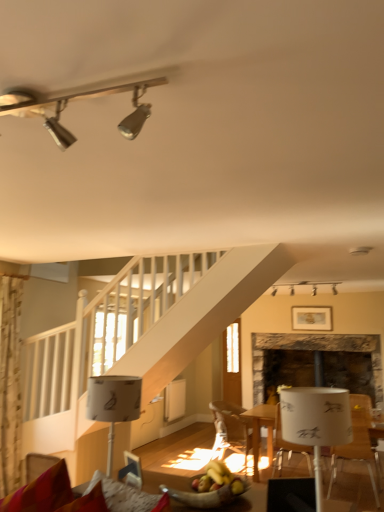
Find the location of a particular element. white plastic chair at lower right, arranged as the 1th chair when viewed from the right is located at coordinates (358, 443).

Measure the distance between point (29, 485) and camera.

Point (29, 485) and camera are 7.10 feet apart from each other.

Image resolution: width=384 pixels, height=512 pixels. In order to click on white plastic chair at lower right, which is counted as the 2th chair, starting from the back in this screenshot , I will do `click(358, 443)`.

Is wooden chair at center, acting as the 2th chair starting from the front, with white paper lampshade at upper center, the third lamp positioned from the front?

No, wooden chair at center, acting as the 2th chair starting from the front, is not making contact with white paper lampshade at upper center, the third lamp positioned from the front.

In terms of size, does wooden chair at center, which ranks as the 1th chair in left-to-right order, appear bigger or smaller than white paper lampshade at upper center, acting as the 3th lamp starting from the left?

Clearly, wooden chair at center, which ranks as the 1th chair in left-to-right order, is larger in size than white paper lampshade at upper center, acting as the 3th lamp starting from the left.

In the scene shown: Considering the relative sizes of wooden chair at center, acting as the 2th chair starting from the front, and white paper lampshade at upper center, the 1th lamp when ordered from right to left, in the image provided, is wooden chair at center, acting as the 2th chair starting from the front, shorter than white paper lampshade at upper center, the 1th lamp when ordered from right to left,?

Incorrect, the height of wooden chair at center, acting as the 2th chair starting from the front, does not fall short of that of white paper lampshade at upper center, the 1th lamp when ordered from right to left.

From the picture: Which is more to the left, clear glass door at center or wooden chair at center, which is the first chair in back-to-front order?

wooden chair at center, which is the first chair in back-to-front order.

Who is shorter, clear glass door at center or wooden chair at center, which ranks as the 1th chair in left-to-right order?

With less height is wooden chair at center, which ranks as the 1th chair in left-to-right order.

Looking at the image, does clear glass door at center seem bigger or smaller compared to wooden chair at center, which is the first chair in back-to-front order?

In the image, clear glass door at center appears to be smaller than wooden chair at center, which is the first chair in back-to-front order.

Is clear glass door at center directly adjacent to wooden chair at center, acting as the 2th chair starting from the front?

clear glass door at center is not next to wooden chair at center, acting as the 2th chair starting from the front, and they're not touching.

From the image's perspective, is black fabric armchair at lower right above white plastic chair at lower right, which is counted as the 2th chair, starting from the back?

Yes, from the image's perspective, black fabric armchair at lower right is over white plastic chair at lower right, which is counted as the 2th chair, starting from the back.

Is black fabric armchair at lower right next to white plastic chair at lower right, which is counted as the second chair, starting from the left, and touching it?

No, black fabric armchair at lower right is not next to white plastic chair at lower right, which is counted as the second chair, starting from the left.

The height and width of the screenshot is (512, 384). I want to click on armchair lying on the left of white plastic chair at lower right, arranged as the 1th chair when viewed from the right, so click(291, 495).

Does wooden chair at center, which ranks as the second chair in right-to-left order, have a larger size compared to wooden bowl of fruit at lower center?

Yes.

Is wooden bowl of fruit at lower center at the back of wooden chair at center, which ranks as the second chair in right-to-left order?

wooden chair at center, which ranks as the second chair in right-to-left order, does not have its back to wooden bowl of fruit at lower center.

Is wooden chair at center, which is the first chair in back-to-front order, to the right of wooden bowl of fruit at lower center from the viewer's perspective?

Indeed, wooden chair at center, which is the first chair in back-to-front order, is positioned on the right side of wooden bowl of fruit at lower center.

Considering the positions of objects wooden chair at center, which ranks as the 1th chair in left-to-right order, and wooden bowl of fruit at lower center in the image provided, who is behind, wooden chair at center, which ranks as the 1th chair in left-to-right order, or wooden bowl of fruit at lower center?

wooden chair at center, which ranks as the 1th chair in left-to-right order, is further from the camera.

From the image's perspective, is stone fireplace at center positioned above or below wooden bowl of fruit at lower center?

From the image's perspective, stone fireplace at center appears below wooden bowl of fruit at lower center.

Would you say wooden bowl of fruit at lower center is part of stone fireplace at center's contents?

No, stone fireplace at center does not contain wooden bowl of fruit at lower center.

Which is in front, point (377, 357) or point (182, 511)?

Positioned in front is point (182, 511).

From the image's perspective, is wooden framed picture at upper center located above or below floral fabric curtain at left?

wooden framed picture at upper center is above floral fabric curtain at left.

How much distance is there between wooden framed picture at upper center and floral fabric curtain at left?

wooden framed picture at upper center is 4.16 meters away from floral fabric curtain at left.

Is wooden framed picture at upper center oriented towards floral fabric curtain at left?

Yes, wooden framed picture at upper center faces towards floral fabric curtain at left.

Between point (331, 316) and point (11, 446), which one is positioned in front?

The point (11, 446) is closer.

From the image's perspective, which is below, floral fabric curtain at left or wooden bowl of fruit at lower center?

floral fabric curtain at left, from the image's perspective.

Is floral fabric curtain at left positioned beyond the bounds of wooden bowl of fruit at lower center?

floral fabric curtain at left is positioned outside wooden bowl of fruit at lower center.

Is floral fabric curtain at left wider than wooden bowl of fruit at lower center?

Correct, the width of floral fabric curtain at left exceeds that of wooden bowl of fruit at lower center.

The width and height of the screenshot is (384, 512). I want to click on lamp behind the wooden chair at center, acting as the 2th chair starting from the front, so click(305, 285).

You are a GUI agent. You are given a task and a screenshot of the screen. Output one action in this format:
    pyautogui.click(x=<x>, y=<y>)
    Task: Click on the glass door that is above the wooden chair at center, which ranks as the 1th chair in left-to-right order (from a real-world perspective)
    
    Given the screenshot: What is the action you would take?
    pyautogui.click(x=232, y=362)

Considering their positions, is white paper lampshade at upper center, acting as the 3th lamp starting from the left, positioned further to white paper lampshade at lower left, which is the 3th lamp from top to bottom, than wooden framed picture at upper center?

wooden framed picture at upper center lies further to white paper lampshade at lower left, which is the 3th lamp from top to bottom, than the other object.

Looking at the image, which one is located further to clear glass door at center, white plastic chair at lower right, the first chair when ordered from front to back, or wooden bowl of fruit at lower center?

The object further to clear glass door at center is wooden bowl of fruit at lower center.

Looking at the image, which one is located further to velvet red couch at lower left, clear glass door at center or wooden bowl of fruit at lower center?

The object further to velvet red couch at lower left is clear glass door at center.

Based on their spatial positions, is white plastic chair at lower right, which is counted as the 2th chair, starting from the back, or white paper lampshade at lower left, which is the 3th lamp from top to bottom, closer to white paper lampshade at upper center, acting as the 3th lamp starting from the left?

white plastic chair at lower right, which is counted as the 2th chair, starting from the back, is closer to white paper lampshade at upper center, acting as the 3th lamp starting from the left.

Estimate the real-world distances between objects in this image. Which object is further from wooden chair at center, acting as the 2th chair starting from the front, white paper lampshade at upper center, which ranks as the 2th lamp in top-to-bottom order, or velvet red couch at lower left?

white paper lampshade at upper center, which ranks as the 2th lamp in top-to-bottom order, is positioned further to the anchor wooden chair at center, acting as the 2th chair starting from the front.

Considering their positions, is white paper lampshade at lower left, positioned as the third lamp in right-to-left order, positioned closer to velvet red couch at lower left than metallic track lighting at upper left, which is the second lamp in right-to-left order?

white paper lampshade at lower left, positioned as the third lamp in right-to-left order, is closer to velvet red couch at lower left.

Considering their positions, is wooden chair at center, which is the first chair in back-to-front order, positioned closer to wooden bowl of fruit at lower center than white paper lampshade at upper center, which is the 1th lamp from back to front?

wooden chair at center, which is the first chair in back-to-front order, lies closer to wooden bowl of fruit at lower center than the other object.

When comparing their distances from floral fabric curtain at left, does clear glass door at center or white paper lampshade at lower left, marked as the second lamp in a front-to-back arrangement, seem further?

clear glass door at center lies further to floral fabric curtain at left than the other object.

The height and width of the screenshot is (512, 384). I want to click on curtain located between metallic track lighting at upper left, which is the second lamp in right-to-left order, and white paper lampshade at upper center, which is the 1th lamp from back to front, in the depth direction, so click(10, 383).

The image size is (384, 512). What are the coordinates of `fireplace positioned between floral fabric curtain at left and clear glass door at center from near to far` in the screenshot? It's located at (315, 350).

Where is `armchair between velvet red couch at lower left and clear glass door at center from front to back`? This screenshot has width=384, height=512. armchair between velvet red couch at lower left and clear glass door at center from front to back is located at coordinates click(291, 495).

Identify the location of picture frame between black fabric armchair at lower right and clear glass door at center from front to back. (312, 318).